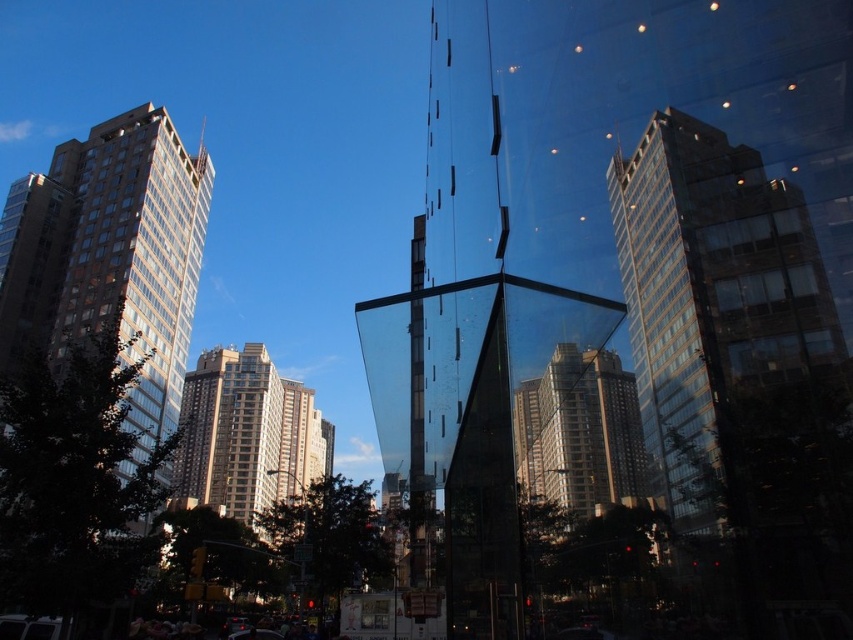
You are standing at the base of the tall buildings in the urban scene. There is a clear glass building at center located at point (x=711, y=298). If you look directly ahead, will the clear glass building at center be visible in your line of sight?

Yes, the clear glass building at center is located at point (x=711, y=298), which is directly ahead in your line of sight.

Consider the image. You are standing in the city square and see the clear glass building at center and the brown glass building at left. Which one is positioned more to the right side?

The clear glass building at center is positioned more to the right side than the brown glass building at left.

You are standing at the base of the beige glass building at center and the matte glass building at center. Which building appears taller when viewed from this angle?

The beige glass building at center appears taller than the matte glass building at center when viewed from this angle because it is bigger in size.